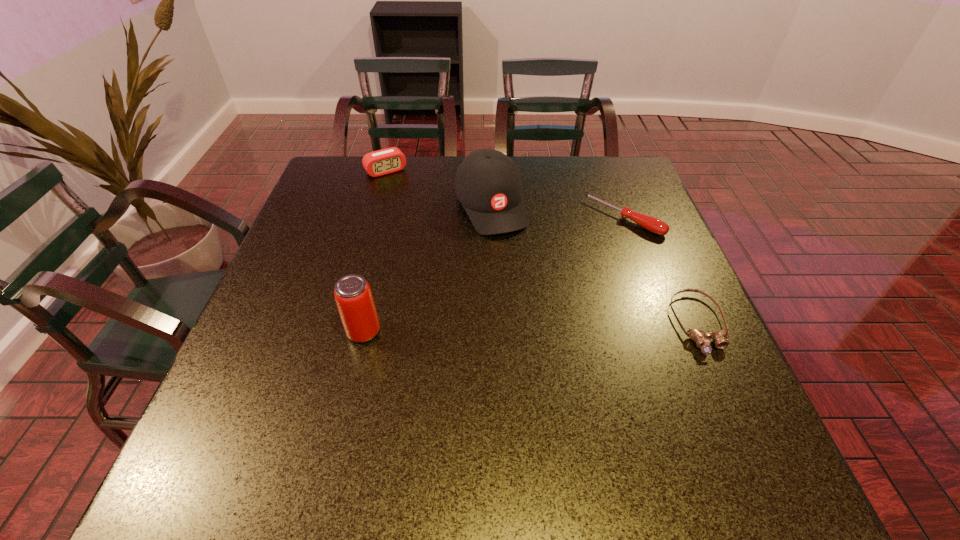
You are a GUI agent. You are given a task and a screenshot of the screen. Output one action in this format:
    pyautogui.click(x=<x>, y=<y>)
    Task: Click on the object that stands as the fourth closest to the beer can
    
    Given the screenshot: What is the action you would take?
    pyautogui.click(x=720, y=340)

Locate which object is the second closest to the alarm clock. Please provide its 2D coordinates. Your answer should be formatted as a tuple, i.e. [(x, y)], where the tuple contains the x and y coordinates of a point satisfying the conditions above.

[(652, 224)]

You are a GUI agent. You are given a task and a screenshot of the screen. Output one action in this format:
    pyautogui.click(x=<x>, y=<y>)
    Task: Click on the free location that satisfies the following two spatial constraints: 1. on the back side of the second shortest object; 2. on the left side of the beer can
    
    Given the screenshot: What is the action you would take?
    pyautogui.click(x=391, y=218)

Where is `free space that satisfies the following two spatial constraints: 1. on the front side of the third object from left to right; 2. on the right side of the fourth tallest object`? The width and height of the screenshot is (960, 540). free space that satisfies the following two spatial constraints: 1. on the front side of the third object from left to right; 2. on the right side of the fourth tallest object is located at coordinates (491, 218).

Find the location of a particular element. free space that satisfies the following two spatial constraints: 1. on the front side of the beer can; 2. on the right side of the third shortest object is located at coordinates (341, 332).